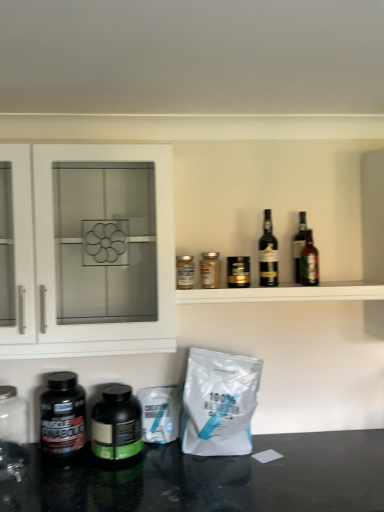
Question: Would you consider transparent glass jar at lower left to be distant from black plastic bottle at lower left, arranged as the 7th bottle when viewed from the right?

Choices:
 (A) yes
 (B) no

Answer: (B)

Question: Is transparent glass jar at lower left to the left of black plastic bottle at lower left, which is the 1th bottle in left-to-right order, from the viewer's perspective?

Choices:
 (A) no
 (B) yes

Answer: (B)

Question: Considering the relative sizes of transparent glass jar at lower left and black plastic bottle at lower left, which is the 1th bottle in left-to-right order, in the image provided, is transparent glass jar at lower left thinner than black plastic bottle at lower left, which is the 1th bottle in left-to-right order,?

Choices:
 (A) no
 (B) yes

Answer: (A)

Question: Is black plastic bottle at lower left, which is the 1th bottle in left-to-right order, completely or partially inside transparent glass jar at lower left?

Choices:
 (A) yes
 (B) no

Answer: (B)

Question: From the image's perspective, is transparent glass jar at lower left under black plastic bottle at lower left, which is the 1th bottle in left-to-right order?

Choices:
 (A) yes
 (B) no

Answer: (B)

Question: Does point (299, 220) appear closer or farther from the camera than point (337, 296)?

Choices:
 (A) farther
 (B) closer

Answer: (A)

Question: Would you say green glass bottle at upper right, which is counted as the 6th bottle, starting from the left, is to the left or to the right of clear glass bottles at upper center in the picture?

Choices:
 (A) left
 (B) right

Answer: (B)

Question: In the image, is green glass bottle at upper right, which is counted as the 6th bottle, starting from the left, positioned in front of or behind clear glass bottles at upper center?

Choices:
 (A) behind
 (B) front

Answer: (A)

Question: Is green glass bottle at upper right, which appears as the second bottle when viewed from the right, wider or thinner than clear glass bottles at upper center?

Choices:
 (A) wide
 (B) thin

Answer: (B)

Question: Is green glass bottle at upper right, which is counted as the 6th bottle, starting from the left, situated inside metallic gold jar at upper center, the 4th bottle from the right, or outside?

Choices:
 (A) outside
 (B) inside

Answer: (A)

Question: From their relative heights in the image, would you say green glass bottle at upper right, which appears as the second bottle when viewed from the right, is taller or shorter than metallic gold jar at upper center, the 4th bottle from the right?

Choices:
 (A) tall
 (B) short

Answer: (A)

Question: From a real-world perspective, is green glass bottle at upper right, which appears as the second bottle when viewed from the right, above or below metallic gold jar at upper center, the 4th bottle from the right?

Choices:
 (A) above
 (B) below

Answer: (A)

Question: In terms of size, does green glass bottle at upper right, which appears as the second bottle when viewed from the right, appear bigger or smaller than metallic gold jar at upper center, the 4th bottle from the right?

Choices:
 (A) small
 (B) big

Answer: (B)

Question: From a real-world perspective, is black matte bottle at lower center, which ranks as the 6th bottle in right-to-left order, physically located above or below matte glass jar at center, the 3th bottle positioned from the left?

Choices:
 (A) above
 (B) below

Answer: (B)

Question: Looking at the image, does black matte bottle at lower center, which ranks as the 6th bottle in right-to-left order, seem bigger or smaller compared to matte glass jar at center, the 3th bottle positioned from the left?

Choices:
 (A) small
 (B) big

Answer: (B)